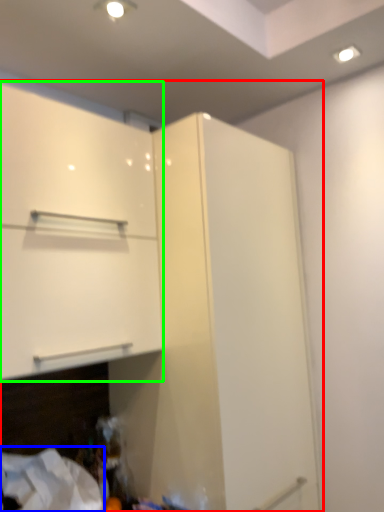
Question: Estimate the real-world distances between objects in this image. Which object is farther from cupboard (highlighted by a red box), sheet (highlighted by a blue box) or cabinetry (highlighted by a green box)?

Choices:
 (A) sheet
 (B) cabinetry

Answer: (A)